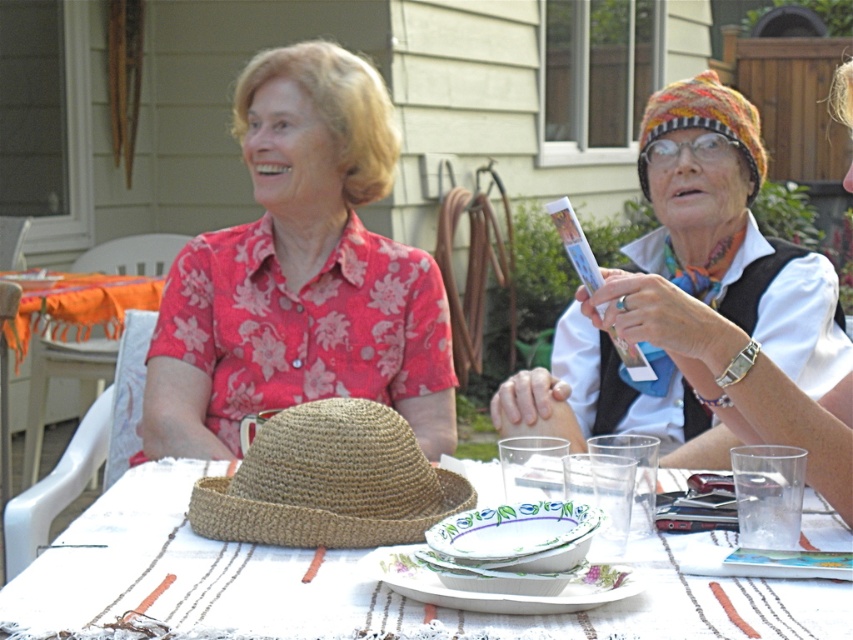
You are standing at the edge of the garden facing the table. There are two points marked on the table surface. The first point is at coordinates point (605, 362) and the second point is at point (135, 301). Which point is closer to you?

Point (605, 362) is in front of point (135, 301), so the first point is closer to you.

You are planning to place a decorative item on the table but need to ensure there is enough space. The braided straw hat at center and the brown woven straw hat at center are both on the table. Which hat is located underneath the other?

The braided straw hat at center is positioned under the brown woven straw hat at center, so the braided one is underneath the brown one.